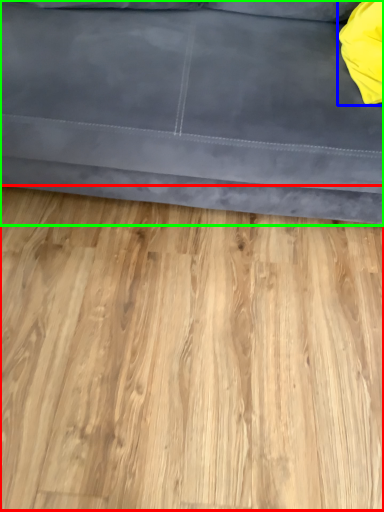
Question: Which is farther away from hardwood (highlighted by a red box)? pillow (highlighted by a blue box) or studio couch (highlighted by a green box)?

Choices:
 (A) pillow
 (B) studio couch

Answer: (A)